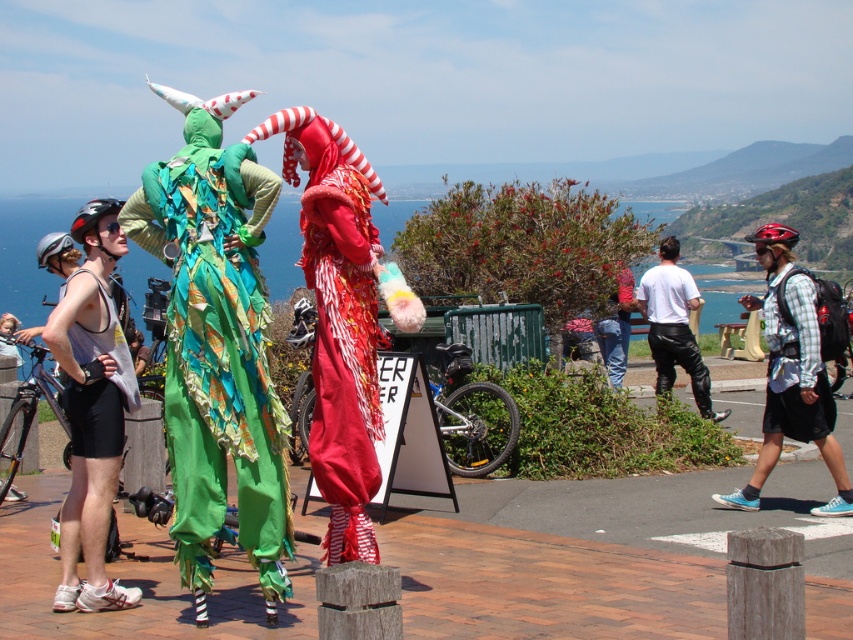
Question: Which point is closer to the camera?

Choices:
 (A) red satin clown at center
 (B) white matte shirt at center

Answer: (A)

Question: Which point is farther from the camera taking this photo?

Choices:
 (A) (817, 296)
 (B) (192, 212)

Answer: (A)

Question: Where is red satin clown at center located in relation to white matte shirt at center in the image?

Choices:
 (A) left
 (B) right

Answer: (A)

Question: Among these points, which one is nearest to the camera?

Choices:
 (A) (129, 227)
 (B) (782, 323)
 (C) (647, 316)
 (D) (345, 196)

Answer: (A)

Question: Is green fabric dragon at left smaller than white matte shirt at center?

Choices:
 (A) yes
 (B) no

Answer: (A)

Question: Is green fabric dragon at left smaller than red satin clown at center?

Choices:
 (A) no
 (B) yes

Answer: (A)